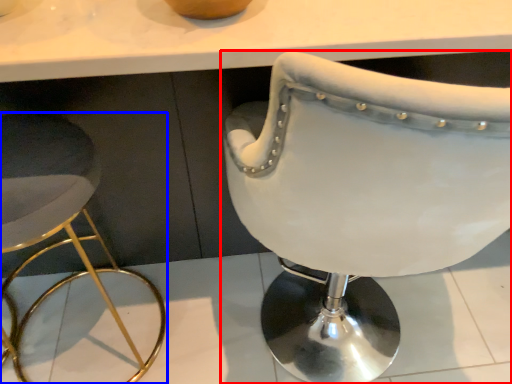
Question: Which of the following is the closest to the observer, chair (highlighted by a red box) or stool (highlighted by a blue box)?

Choices:
 (A) chair
 (B) stool

Answer: (A)